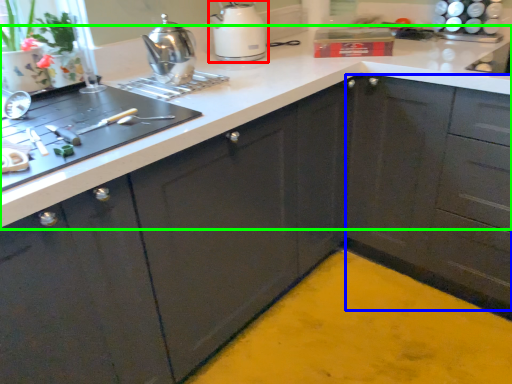
Question: Which object is the closest to the kitchen appliance (highlighted by a red box)? Choose among these: cabinetry (highlighted by a blue box) or countertop (highlighted by a green box).

Choices:
 (A) cabinetry
 (B) countertop

Answer: (B)